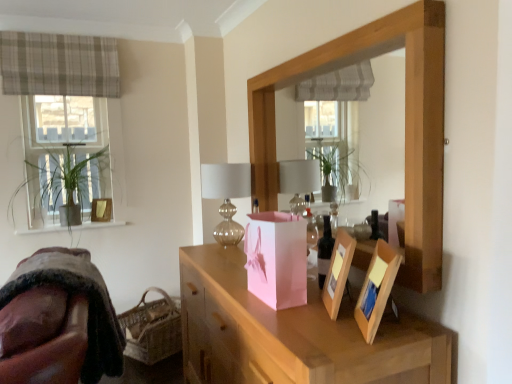
This screenshot has height=384, width=512. Describe the element at coordinates (101, 210) in the screenshot. I see `matte gold picture frame at upper left` at that location.

This screenshot has width=512, height=384. What do you see at coordinates (73, 293) in the screenshot?
I see `brown suede swivel chair at lower left` at bounding box center [73, 293].

This screenshot has width=512, height=384. What do you see at coordinates (277, 259) in the screenshot?
I see `pink paper bag at center` at bounding box center [277, 259].

What is the approximate width of pink paper bag at center?

It is 9.54 inches.

Identify the location of translucent glass table lamp at center. The image size is (512, 384). (226, 196).

Where is `matte gold picture frame at upper left`? matte gold picture frame at upper left is located at coordinates click(x=101, y=210).

From the image's perspective, is pink paper bag at center located above wooden mirror at upper center?

No, from the image's perspective, pink paper bag at center is not above wooden mirror at upper center.

Are pink paper bag at center and wooden mirror at upper center making contact?

No, pink paper bag at center is not making contact with wooden mirror at upper center.

From a real-world perspective, is pink paper bag at center located higher than wooden mirror at upper center?

No, from a real-world perspective, pink paper bag at center is not over wooden mirror at upper center

Looking at this image, is plaid fabric curtain at upper left turned away from pink paper bag at center?

No.

Considering the sizes of plaid fabric curtain at upper left and pink paper bag at center in the image, is plaid fabric curtain at upper left taller or shorter than pink paper bag at center?

Considering their sizes, plaid fabric curtain at upper left has more height than pink paper bag at center.

From a real-world perspective, is plaid fabric curtain at upper left below pink paper bag at center?

Actually, plaid fabric curtain at upper left is physically above pink paper bag at center in the real world.

Can you tell me how much plaid fabric curtain at upper left and pink paper bag at center differ in facing direction?

plaid fabric curtain at upper left and pink paper bag at center are facing 92.9 degrees away from each other.

How much distance is there between translucent glass table lamp at center and woven brown basket at lower left?

translucent glass table lamp at center and woven brown basket at lower left are 3.80 feet apart.

From the image's perspective, is translucent glass table lamp at center positioned above or below woven brown basket at lower left?

Clearly, from the image's perspective, translucent glass table lamp at center is above woven brown basket at lower left.

Between translucent glass table lamp at center and woven brown basket at lower left, which one appears on the left side from the viewer's perspective?

Positioned to the left is woven brown basket at lower left.

From a real-world perspective, which is physically above, translucent glass table lamp at center or woven brown basket at lower left?

In real-world perspective, translucent glass table lamp at center is above.

From the image's perspective, is brown suede swivel chair at lower left beneath pink paper bag at center?

Correct, brown suede swivel chair at lower left appears lower than pink paper bag at center in the image.

Is brown suede swivel chair at lower left looking in the opposite direction of pink paper bag at center?

No, brown suede swivel chair at lower left's orientation is not away from pink paper bag at center.

The height and width of the screenshot is (384, 512). In order to click on swivel chair lying behind the pink paper bag at center in this screenshot , I will do `click(73, 293)`.

Does translucent glass table lamp at center have a greater width compared to brown suede swivel chair at lower left?

Incorrect, the width of translucent glass table lamp at center does not surpass that of brown suede swivel chair at lower left.

Is translucent glass table lamp at center oriented away from brown suede swivel chair at lower left?

No, translucent glass table lamp at center is not facing the opposite direction of brown suede swivel chair at lower left.

Is there a large distance between translucent glass table lamp at center and brown suede swivel chair at lower left?

That's not correct — translucent glass table lamp at center is a little close to brown suede swivel chair at lower left.

Does point (244, 181) come closer to viewer compared to point (348, 302)?

No, (244, 181) is behind (348, 302).

From a real-world perspective, is translucent glass table lamp at center above or below pink paper bag at center?

translucent glass table lamp at center is above pink paper bag at center.

Visually, is translucent glass table lamp at center positioned to the left or to the right of pink paper bag at center?

translucent glass table lamp at center is to the left of pink paper bag at center.

Would you consider translucent glass table lamp at center to be distant from pink paper bag at center?

translucent glass table lamp at center is near pink paper bag at center, not far away.

Does brown suede swivel chair at lower left turn towards matte gold picture frame at upper left?

No, brown suede swivel chair at lower left does not turn towards matte gold picture frame at upper left.

How distant is brown suede swivel chair at lower left from matte gold picture frame at upper left?

1.32 meters.

Which of these two, brown suede swivel chair at lower left or matte gold picture frame at upper left, is smaller?

Smaller between the two is matte gold picture frame at upper left.

Considering their positions, is brown suede swivel chair at lower left located in front of or behind matte gold picture frame at upper left?

In the image, brown suede swivel chair at lower left appears in front of matte gold picture frame at upper left.

The image size is (512, 384). I want to click on mirror that appears in front of the pink paper bag at center, so click(405, 123).

The height and width of the screenshot is (384, 512). Find the location of `package located below the plaid fabric curtain at upper left (from the image's perspective)`. package located below the plaid fabric curtain at upper left (from the image's perspective) is located at coordinates (277, 259).

Looking at the image, which one is located further to dark brown glass bottle at center, wooden mirror at upper center or green leafy plant at left?

The object further to dark brown glass bottle at center is green leafy plant at left.

Which object lies further to the anchor point woven brown basket at lower left, green leafy plant at left or plaid fabric curtain at upper left?

plaid fabric curtain at upper left is positioned further to the anchor woven brown basket at lower left.

From the image, which object appears to be farther from wooden mirror at upper center, woven brown basket at lower left or dark brown glass bottle at center?

woven brown basket at lower left.

Which object lies nearer to the anchor point green leafy plant at left, matte gold picture frame at upper left or dark brown glass bottle at center?

matte gold picture frame at upper left.

When comparing their distances from matte gold picture frame at upper left, does pink paper bag at center or translucent glass table lamp at center seem closer?

Among the two, translucent glass table lamp at center is located nearer to matte gold picture frame at upper left.

Estimate the real-world distances between objects in this image. Which object is further from matte gold picture frame at upper left, wooden mirror at upper center or green leafy plant at left?

Based on the image, wooden mirror at upper center appears to be further to matte gold picture frame at upper left.

Considering their positions, is woven brown basket at lower left positioned closer to pink paper bag at center than pink paper bag at center?

pink paper bag at center is positioned closer to the anchor pink paper bag at center.

Estimate the real-world distances between objects in this image. Which object is further from woven brown basket at lower left, matte gold picture frame at upper left or wooden mirror at upper center?

wooden mirror at upper center is positioned further to the anchor woven brown basket at lower left.

This screenshot has height=384, width=512. I want to click on plant that lies between plaid fabric curtain at upper left and brown suede swivel chair at lower left from top to bottom, so click(x=66, y=185).

Where is `package located between plaid fabric curtain at upper left and dark brown glass bottle at center in the left-right direction`? The height and width of the screenshot is (384, 512). package located between plaid fabric curtain at upper left and dark brown glass bottle at center in the left-right direction is located at coordinates (277, 259).

Find the location of a particular element. This screenshot has width=512, height=384. table lamp between plaid fabric curtain at upper left and dark brown glass bottle at center from left to right is located at coordinates (226, 196).

Find the location of a particular element. This screenshot has width=512, height=384. wine bottle between pink paper bag at center and woven brown basket at lower left in the front-back direction is located at coordinates (324, 251).